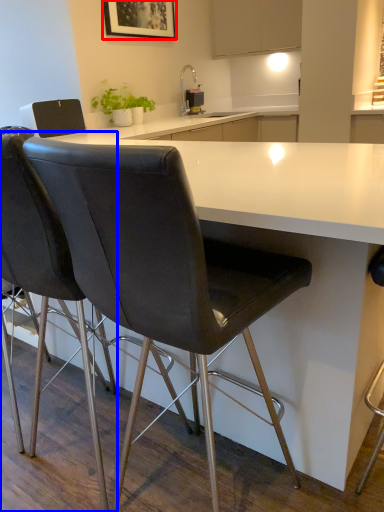
Question: Which point is closer to the camera, picture frame (highlighted by a red box) or chair (highlighted by a blue box)?

Choices:
 (A) picture frame
 (B) chair

Answer: (B)